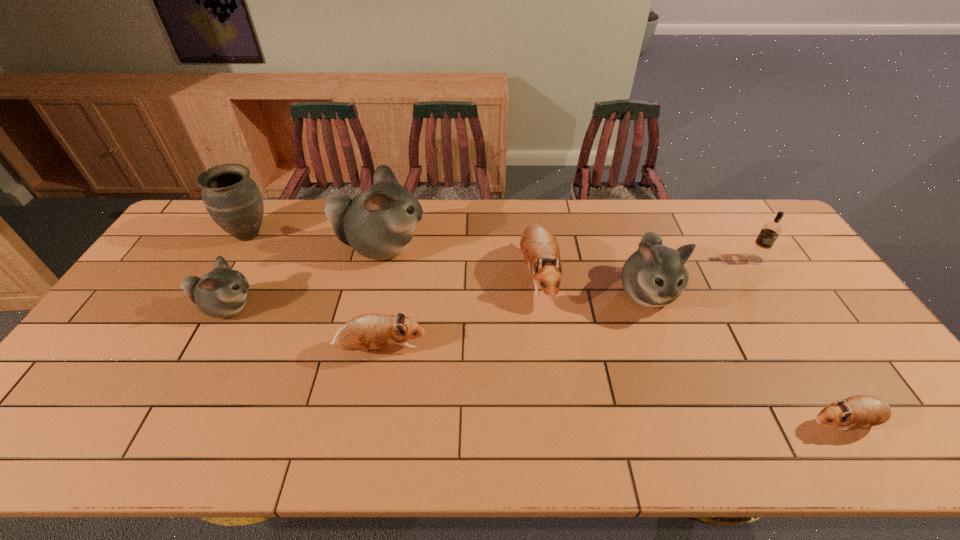
Where is `the second white hamster from left to right`? The image size is (960, 540). the second white hamster from left to right is located at coordinates (378, 223).

The width and height of the screenshot is (960, 540). Find the location of `the biggest white hamster`. the biggest white hamster is located at coordinates (378, 223).

At what (x,y) coordinates should I click in order to perform the action: click on urn. Please return your answer as a coordinate pair (x, y). The height and width of the screenshot is (540, 960). Looking at the image, I should click on (233, 200).

Image resolution: width=960 pixels, height=540 pixels. Identify the location of the third object from right to left. (653, 276).

Find the location of `the rightmost white hamster`. the rightmost white hamster is located at coordinates (653, 276).

Locate an element on the screen. The image size is (960, 540). vodka is located at coordinates (770, 231).

I want to click on the smallest white hamster, so (223, 292).

The height and width of the screenshot is (540, 960). In order to click on the leftmost white hamster in this screenshot , I will do `click(223, 292)`.

You are a GUI agent. You are given a task and a screenshot of the screen. Output one action in this format:
    pyautogui.click(x=<x>, y=<y>)
    Task: Click on the biggest brown hamster
    The height and width of the screenshot is (540, 960).
    Given the screenshot: What is the action you would take?
    pyautogui.click(x=540, y=250)

Find the location of a particular element. the second brown hamster from left to right is located at coordinates (540, 250).